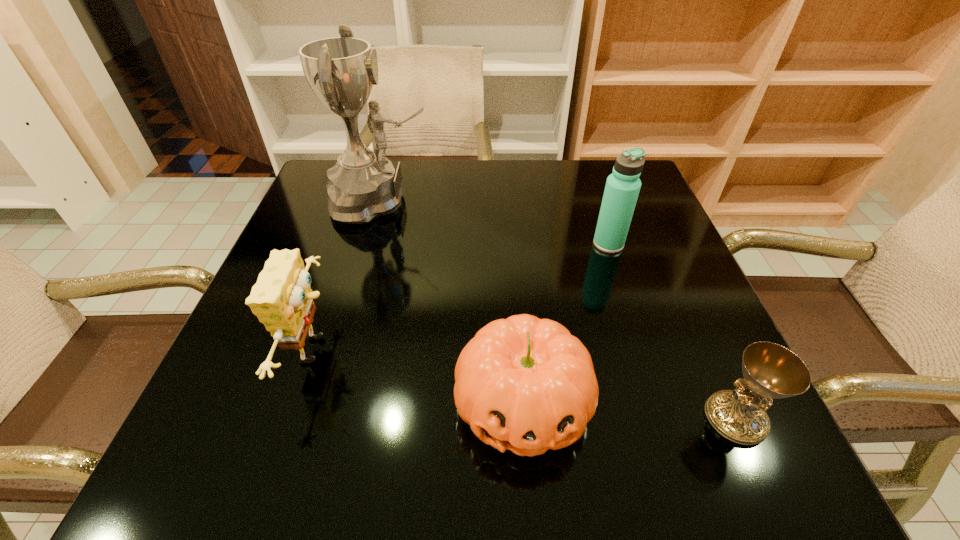
This screenshot has width=960, height=540. Identify the location of object that is at the far edge. (341, 71).

Image resolution: width=960 pixels, height=540 pixels. I want to click on pumpkin present at the near edge, so click(x=526, y=384).

Identify the location of chalice located at the near edge. (771, 371).

Locate an element on the screen. The image size is (960, 540). award present at the left edge is located at coordinates (341, 71).

Locate an element on the screen. The image size is (960, 540). sponge that is positioned at the left edge is located at coordinates (282, 297).

Find the location of a particular element. The image size is (960, 540). thermos bottle present at the right edge is located at coordinates (622, 188).

Locate an element on the screen. chalice located at the right edge is located at coordinates (771, 371).

The width and height of the screenshot is (960, 540). In order to click on object positioned at the far left corner in this screenshot , I will do `click(341, 71)`.

Identify the location of object situated at the near right corner. click(x=771, y=371).

At what (x,y) coordinates should I click in order to perform the action: click on free location at the far edge. Please return your answer as a coordinate pair (x, y). This screenshot has height=540, width=960. Looking at the image, I should click on (418, 188).